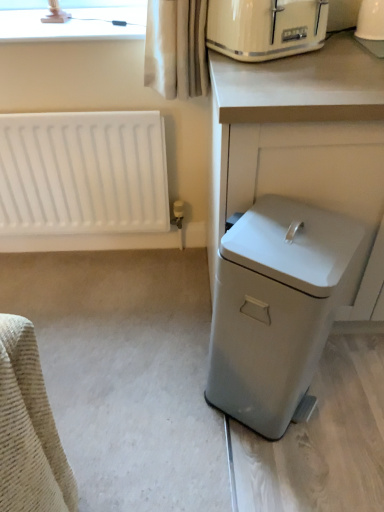
Question: Does point (256, 46) appear closer or farther from the camera than point (331, 159)?

Choices:
 (A) farther
 (B) closer

Answer: (A)

Question: Considering their positions, is matte cream toaster at upper right located in front of or behind white plastic trash can at right?

Choices:
 (A) behind
 (B) front

Answer: (A)

Question: Which is nearer to the matte cream toaster at upper right?

Choices:
 (A) matte white lampshade at upper left
 (B) white glossy coffee maker at upper right
 (C) white matte radiator at left
 (D) white matte trash can at lower right
 (E) white plastic trash can at right

Answer: (E)

Question: Which object is positioned farthest from the matte cream toaster at upper right?

Choices:
 (A) white matte radiator at left
 (B) white plastic trash can at right
 (C) white glossy coffee maker at upper right
 (D) white matte trash can at lower right
 (E) matte white lampshade at upper left

Answer: (A)